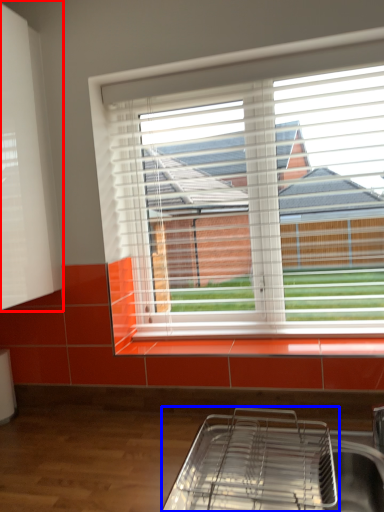
Question: Which point is further to the camera, shutter (highlighted by a red box) or appliance (highlighted by a blue box)?

Choices:
 (A) shutter
 (B) appliance

Answer: (A)